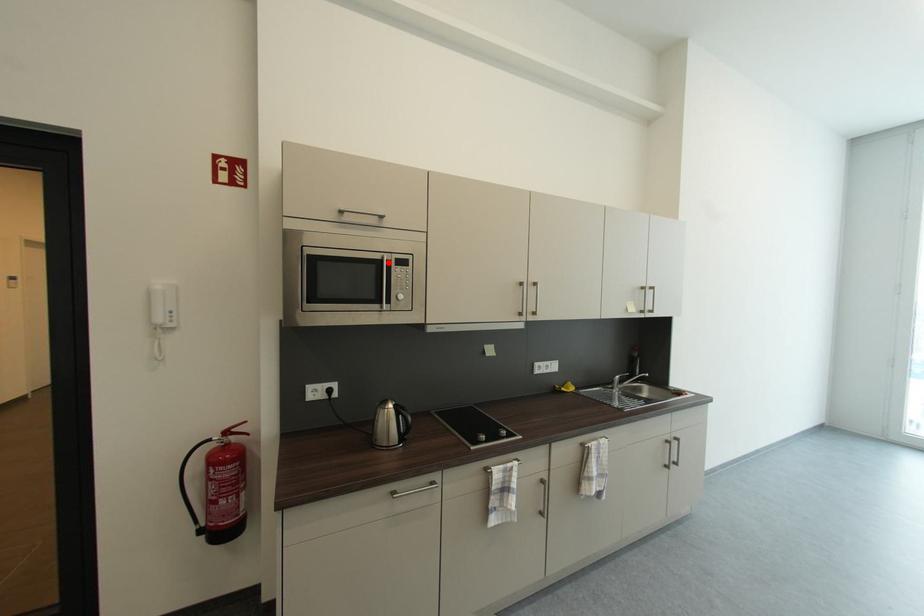
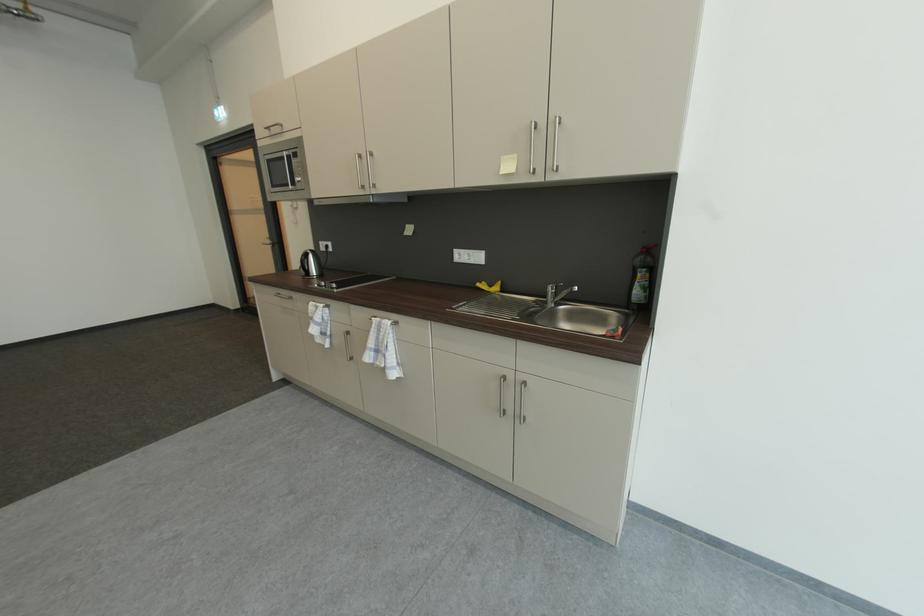
The point at the highlighted location is marked in the first image. Where is the corresponding point in the second image?

(290, 158)